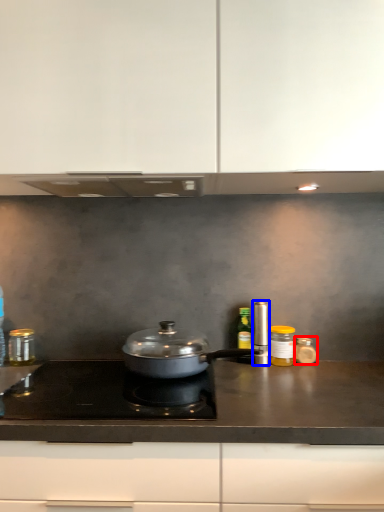
Question: Among these objects, which one is farthest to the camera, kitchen appliance (highlighted by a red box) or kitchen appliance (highlighted by a blue box)?

Choices:
 (A) kitchen appliance
 (B) kitchen appliance

Answer: (A)